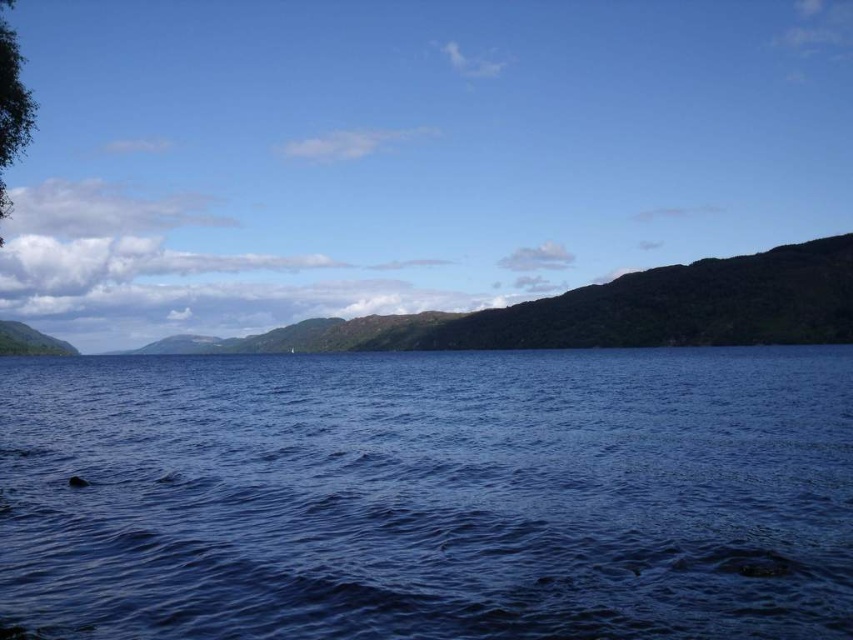
From the picture: You are standing at the edge of the lake and notice the blue liquid water at center and the green leafy tree at upper left. Which object is positioned to the right of the other?

The blue liquid water at center is to the right of the green leafy tree at upper left.

You are standing at the origin point in the image. Where is the blue liquid water at center located in terms of its 2D coordinates?

The blue liquid water at center is located at the 2D coordinates of point (430, 496).